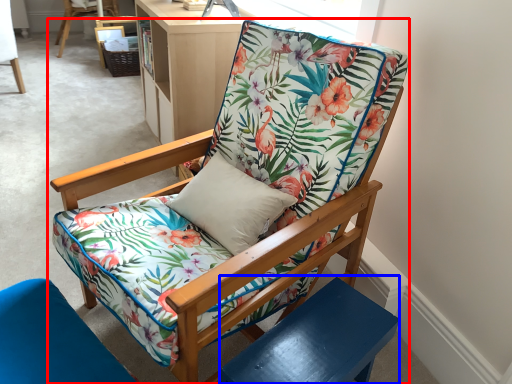
Question: Which object is closer to the camera taking this photo, chair (highlighted by a red box) or side table (highlighted by a blue box)?

Choices:
 (A) chair
 (B) side table

Answer: (A)